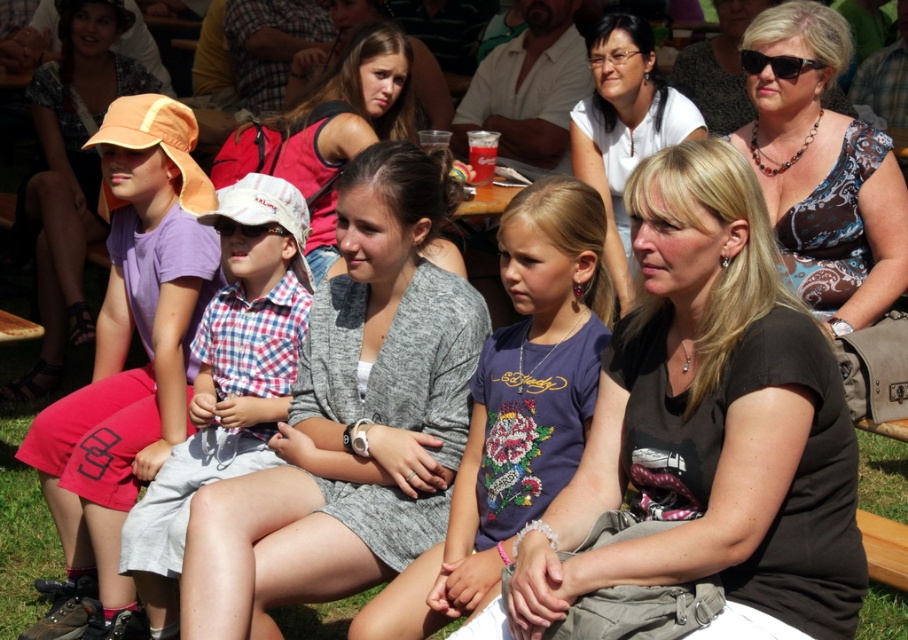
You are standing in the park and see the brown patterned dress at center and the green grass at lower center. Which object is positioned to the left of the other?

The brown patterned dress at center is to the left of green grass at lower center.

You are trying to decide which of the two center individuals to approach for directions. The person wearing the black matte shirt at center is shorter than the gray cotton cardigan at center. Which one would you choose if you want to ask someone taller?

You should approach the gray cotton cardigan at center because it is taller than the black matte shirt at center.

You are a photographer trying to capture a clear shot of both the black matte shirt at center and the gray cotton cardigan at center. Since you want both subjects in focus, which one should you adjust your camera focus to prioritize first?

The black matte shirt at center is closer to the viewer than the gray cotton cardigan at center. To ensure both are in focus, prioritize focusing on the black matte shirt at center first, as it is nearer, and the depth of field may naturally include the gray cotton cardigan at center in the background.